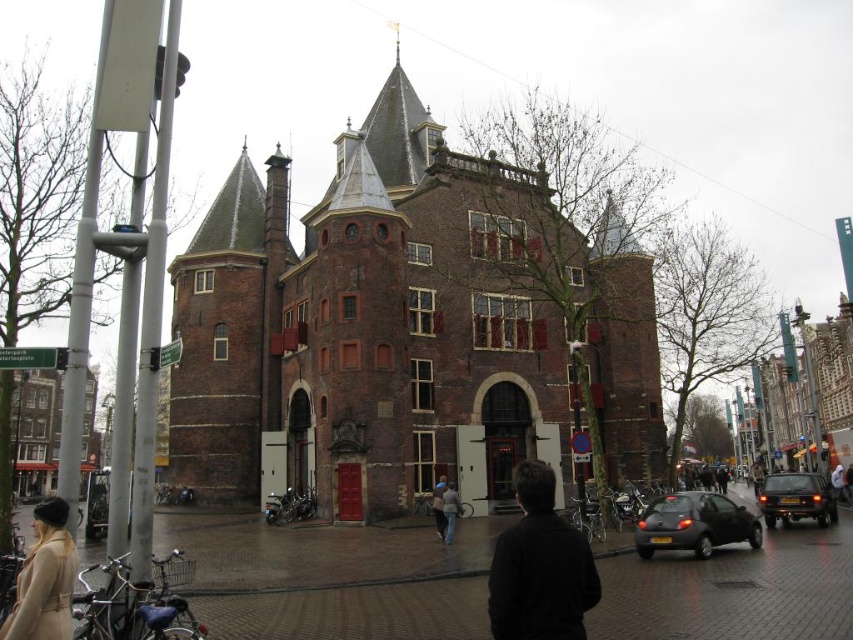
Question: Is matte black car at lower right thinner than dark brown leather jacket at center?

Choices:
 (A) yes
 (B) no

Answer: (B)

Question: Can you confirm if beige wool coat at lower left is bigger than dark brown leather jacket at center?

Choices:
 (A) yes
 (B) no

Answer: (A)

Question: In this image, where is black glossy car at lower right located relative to dark brown leather jacket at center?

Choices:
 (A) below
 (B) above

Answer: (A)

Question: Which of the following is the farthest from the observer?

Choices:
 (A) (440, 483)
 (B) (442, 538)
 (C) (62, 637)
 (D) (792, 476)

Answer: (D)

Question: Which point is closer to the camera?

Choices:
 (A) (543, 568)
 (B) (457, 515)
 (C) (436, 509)
 (D) (688, 534)

Answer: (A)

Question: Which object is positioned closest to the matte black car at lower right?

Choices:
 (A) black glossy car at lower right
 (B) white hoodie at center
 (C) dark brown leather jacket at center

Answer: (A)